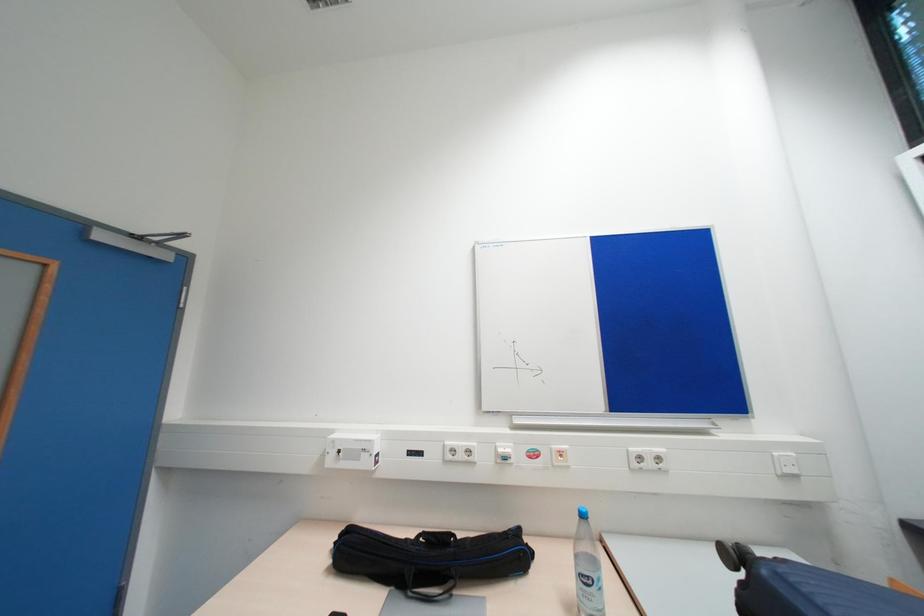
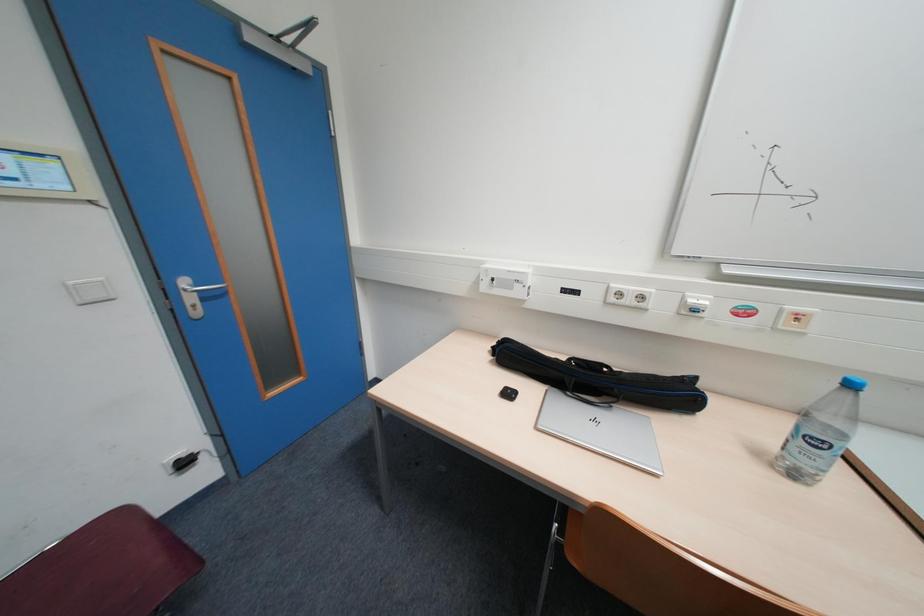
Based on the continuous images, in which direction is the camera rotating?

The camera rotated toward left-down.